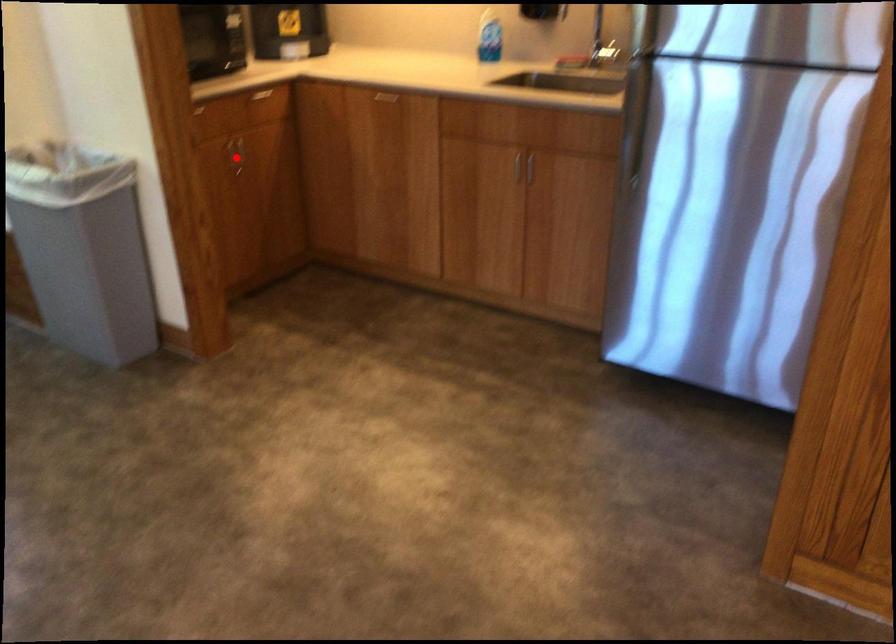
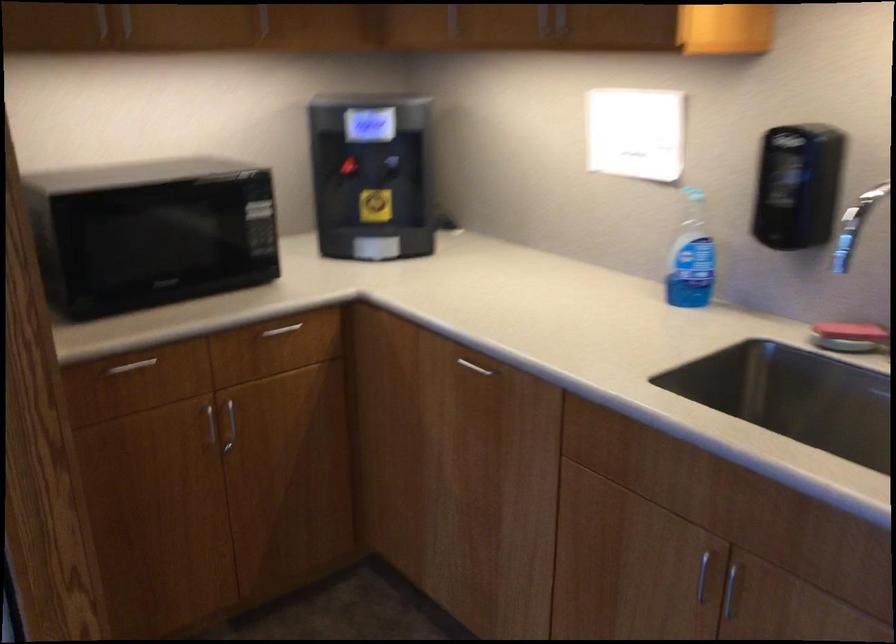
Question: I am providing you with two images of the same scene from different viewpoints. Image1 has a red point marked. In image2, the corresponding 3D location appears at what relative position? Reply with the corresponding letter.

Choices:
 (A) Closer
 (B) Farther

Answer: (A)